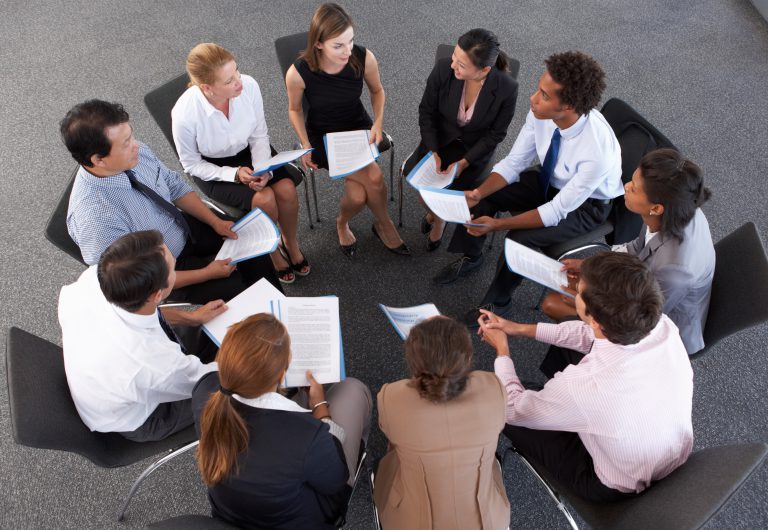
This screenshot has width=768, height=530. I want to click on chair, so click(x=177, y=525), click(x=35, y=419), click(x=55, y=219), click(x=151, y=97), click(x=276, y=45), click(x=511, y=65), click(x=634, y=120), click(x=743, y=258), click(x=707, y=479), click(x=369, y=483).